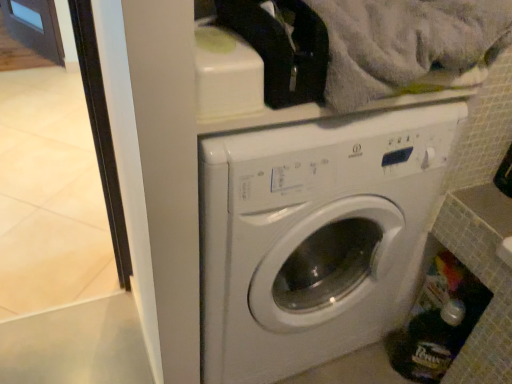
Question: Considering the positions of white glossy washing machine at center and translucent plastic bottle at lower right in the image, is white glossy washing machine at center wider or thinner than translucent plastic bottle at lower right?

Choices:
 (A) thin
 (B) wide

Answer: (B)

Question: In terms of height, does white glossy washing machine at center look taller or shorter compared to translucent plastic bottle at lower right?

Choices:
 (A) short
 (B) tall

Answer: (B)

Question: Would you say white glossy washing machine at center is inside or outside translucent plastic bottle at lower right?

Choices:
 (A) outside
 (B) inside

Answer: (A)

Question: In terms of width, does translucent plastic bottle at lower right look wider or thinner when compared to white glossy washing machine at center?

Choices:
 (A) thin
 (B) wide

Answer: (A)

Question: Do you think translucent plastic bottle at lower right is within white glossy washing machine at center, or outside of it?

Choices:
 (A) outside
 (B) inside

Answer: (A)

Question: Is translucent plastic bottle at lower right taller or shorter than white glossy washing machine at center?

Choices:
 (A) short
 (B) tall

Answer: (A)

Question: In the image, is translucent plastic bottle at lower right on the left side or the right side of white glossy washing machine at center?

Choices:
 (A) left
 (B) right

Answer: (B)